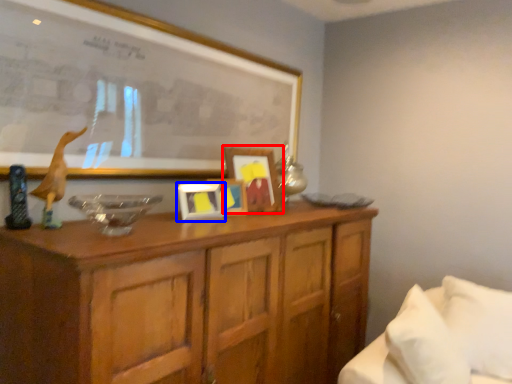
Question: Which object is further to the camera taking this photo, picture frame (highlighted by a red box) or picture frame (highlighted by a blue box)?

Choices:
 (A) picture frame
 (B) picture frame

Answer: (A)